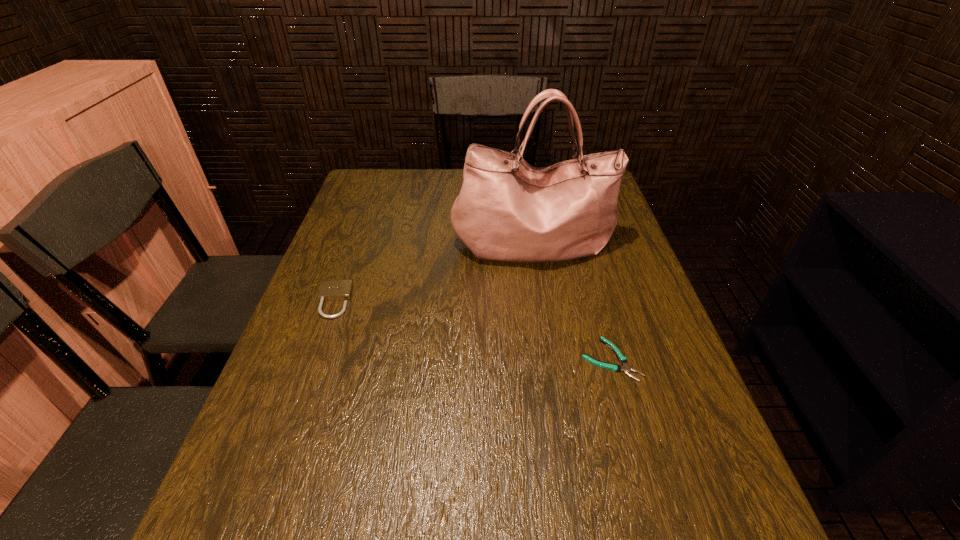
The width and height of the screenshot is (960, 540). What are the coordinates of `handbag located in the right edge section of the desktop` in the screenshot? It's located at (508, 210).

At what (x,y) coordinates should I click in order to perform the action: click on pliers present at the right edge. Please return your answer as a coordinate pair (x, y). Looking at the image, I should click on (626, 368).

Where is `free space at the far edge of the desktop`? free space at the far edge of the desktop is located at coordinates (451, 199).

I want to click on vacant region at the left edge of the desktop, so click(x=232, y=500).

In the image, there is a desktop. In order to click on vacant space at the right edge in this screenshot , I will do `click(586, 278)`.

Find the location of a particular element. vacant space at the far left corner of the desktop is located at coordinates (380, 199).

Find the location of `free space between the farthest object and the nearest object`. free space between the farthest object and the nearest object is located at coordinates (572, 301).

Where is `vacant region between the tallest object and the shortest object`? This screenshot has height=540, width=960. vacant region between the tallest object and the shortest object is located at coordinates 572,301.

This screenshot has width=960, height=540. Identify the location of free space between the shortest object and the second farthest object. (472, 330).

Locate an element on the screen. The width and height of the screenshot is (960, 540). free space that is in between the second nearest object and the farthest object is located at coordinates (434, 273).